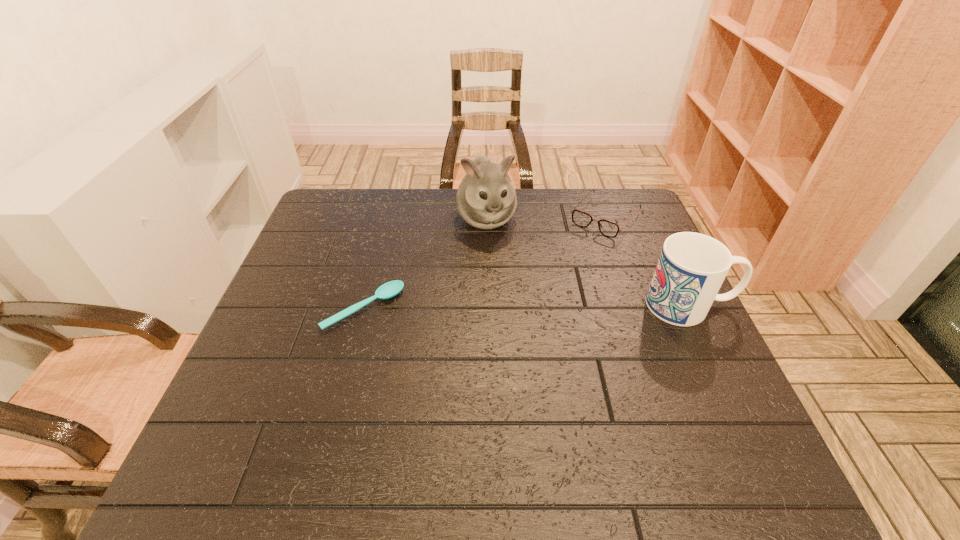
Locate an element on the screen. vacant space on the desktop that is between the leftmost object and the third shortest object and is positioned on the front-facing side of the sunglasses is located at coordinates (530, 307).

I want to click on vacant space on the desktop that is between the leftmost object and the third shortest object and is positioned on the face of the second object from left to right, so [518, 307].